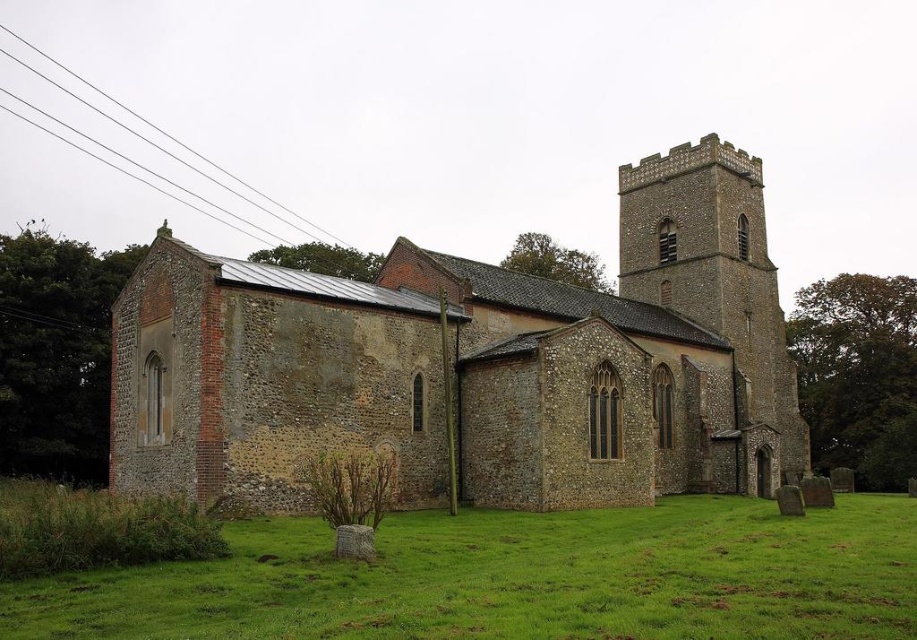
Question: From the image, what is the correct spatial relationship of green grass at lower center in relation to brown stone church tower at upper right?

Choices:
 (A) below
 (B) above

Answer: (A)

Question: Which point is farther from the camera taking this photo?

Choices:
 (A) (645, 232)
 (B) (175, 394)

Answer: (A)

Question: Where is green grass at lower center located in relation to brown stone church tower at upper right in the image?

Choices:
 (A) right
 (B) left

Answer: (B)

Question: Can you confirm if brown stone church at center is positioned to the left of green grass at lower center?

Choices:
 (A) yes
 (B) no

Answer: (A)

Question: Based on their relative distances, which object is farther from the brown stone church at center?

Choices:
 (A) brown stone church tower at upper right
 (B) green grass at lower center

Answer: (B)

Question: Which point is farther to the camera?

Choices:
 (A) (442, 588)
 (B) (584, 330)
 (C) (711, 262)

Answer: (C)